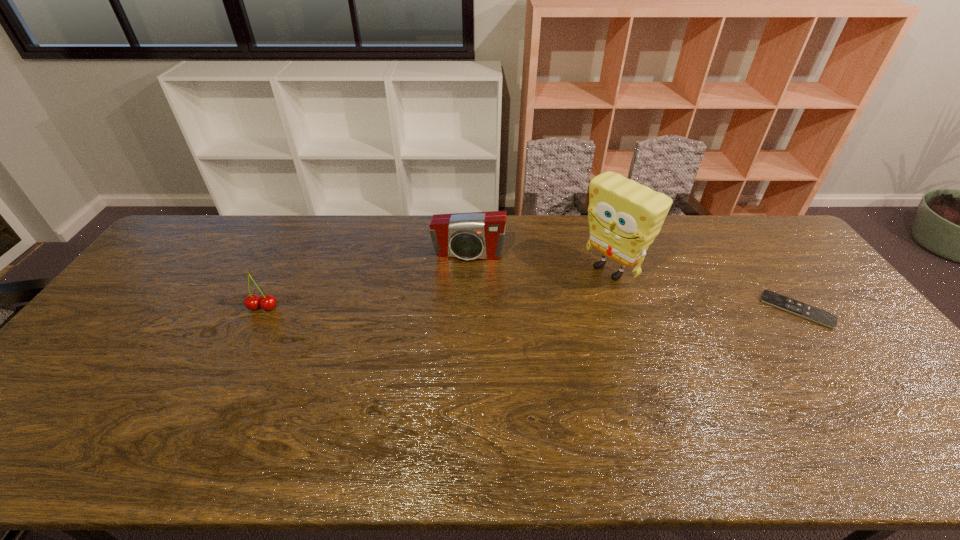
The image size is (960, 540). I want to click on blank space located on the front-facing side of the third shortest object, so click(462, 279).

Where is `free space located 0.340m on the front-facing side of the third shortest object`? The width and height of the screenshot is (960, 540). free space located 0.340m on the front-facing side of the third shortest object is located at coordinates (449, 346).

Where is `vacant space situated 0.240m on the front-facing side of the third shortest object`? vacant space situated 0.240m on the front-facing side of the third shortest object is located at coordinates (454, 319).

At what (x,y) coordinates should I click in order to perform the action: click on vacant space situated on the face of the third object from left to right. Please return your answer as a coordinate pair (x, y). This screenshot has height=540, width=960. Looking at the image, I should click on (516, 338).

This screenshot has width=960, height=540. What are the coordinates of `vacant space located 0.180m on the face of the third object from left to right` in the screenshot? It's located at (550, 313).

Identify the location of vacant area located 0.230m on the face of the third object from left to right. (539, 322).

You are a GUI agent. You are given a task and a screenshot of the screen. Output one action in this format:
    pyautogui.click(x=<x>, y=<y>)
    Task: Click on the camera that is at the far edge
    
    Given the screenshot: What is the action you would take?
    pyautogui.click(x=478, y=235)

You are a GUI agent. You are given a task and a screenshot of the screen. Output one action in this format:
    pyautogui.click(x=<x>, y=<y>)
    Task: Click on the sponge that is at the far edge
    
    Given the screenshot: What is the action you would take?
    pyautogui.click(x=624, y=217)

You are a GUI agent. You are given a task and a screenshot of the screen. Output one action in this format:
    pyautogui.click(x=<x>, y=<y>)
    Task: Click on the object situated at the right edge
    The width and height of the screenshot is (960, 540).
    Given the screenshot: What is the action you would take?
    pyautogui.click(x=822, y=317)

The height and width of the screenshot is (540, 960). Find the location of `free region at the far edge`. free region at the far edge is located at coordinates (584, 222).